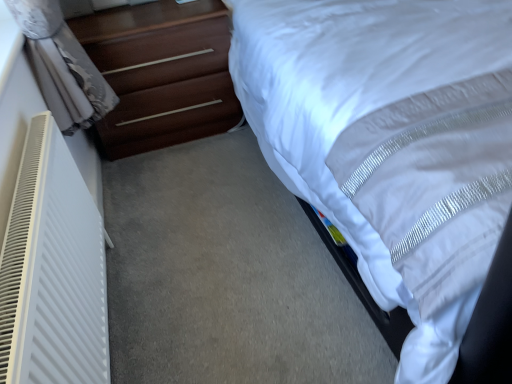
This screenshot has width=512, height=384. I want to click on vacant area that is situated to the right of white plastic radiator at left, so click(227, 317).